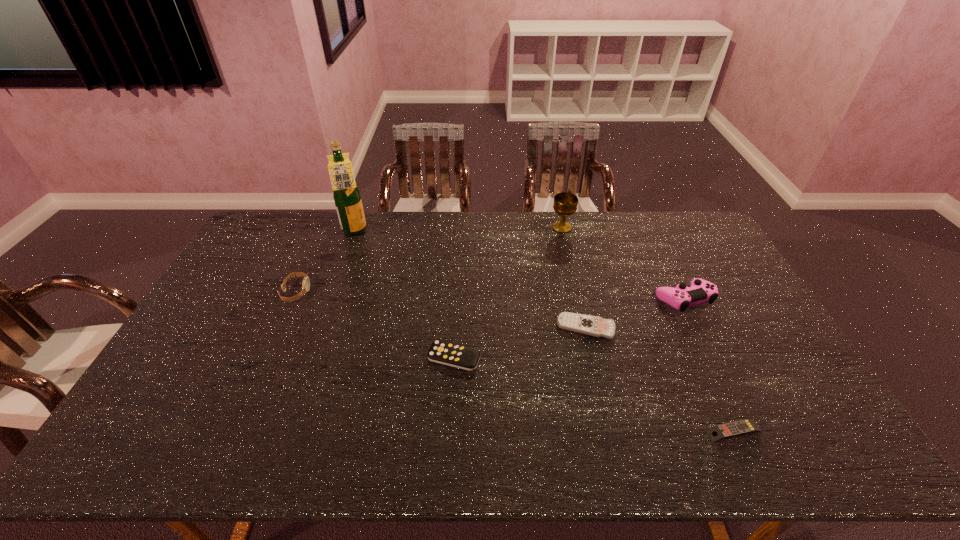
The image size is (960, 540). What are the coordinates of `the nearest object` in the screenshot? It's located at (746, 426).

What are the coordinates of `vacant space situated on the front-facing side of the liquor` in the screenshot? It's located at (448, 232).

The height and width of the screenshot is (540, 960). I want to click on vacant space located 0.350m on the front of the chalice, so click(x=579, y=300).

Locate an element on the screen. The width and height of the screenshot is (960, 540). vacant region located on the front of the third tallest object is located at coordinates (733, 402).

The image size is (960, 540). Find the location of `vacant space located 0.140m on the face of the fourth tallest object`. vacant space located 0.140m on the face of the fourth tallest object is located at coordinates (352, 292).

Identify the location of free space located 0.100m on the left of the fifth object from right to left. (392, 357).

The image size is (960, 540). I want to click on vacant space located 0.090m on the left of the farthest remote control, so click(x=527, y=328).

Find the location of `free region located 0.390m on the left of the nearest remote control`. free region located 0.390m on the left of the nearest remote control is located at coordinates (544, 431).

Image resolution: width=960 pixels, height=540 pixels. In order to click on liquor situated at the far edge in this screenshot , I will do `click(346, 194)`.

Where is `chalice present at the far edge`? chalice present at the far edge is located at coordinates (565, 204).